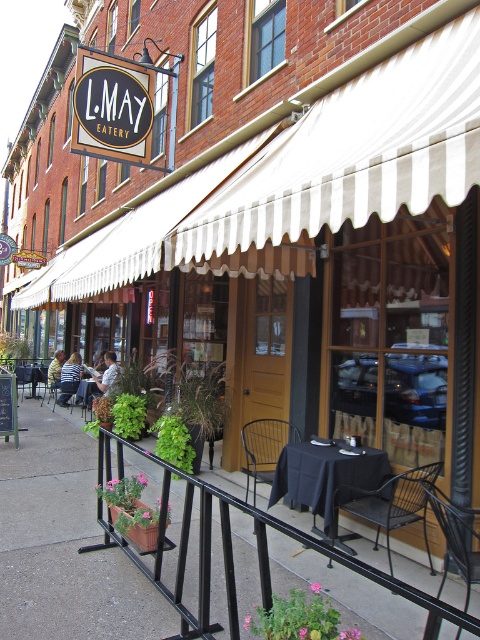
Is white striped awning at center shorter than light brown hair at center?

No.

Does point (396, 164) come behind point (108, 388)?

No, (396, 164) is closer to viewer.

Where is `white striped awning at center`? The width and height of the screenshot is (480, 640). white striped awning at center is located at coordinates (349, 157).

Locate an element on the screen. The width and height of the screenshot is (480, 640). white striped awning at center is located at coordinates (349, 157).

Who is more distant from viewer, (305,129) or (459,531)?

Point (305,129)

How distant is white striped awning at center from black metal chair at lower right?

The distance of white striped awning at center from black metal chair at lower right is 2.53 meters.

Locate an element on the screen. The height and width of the screenshot is (640, 480). white striped awning at center is located at coordinates (349, 157).

Where is `black wire chair at lower center`? This screenshot has width=480, height=640. black wire chair at lower center is located at coordinates pos(264,449).

Which of these two, black wire chair at lower center or light brown hair at center, stands taller?

black wire chair at lower center is taller.

You are a GUI agent. You are given a task and a screenshot of the screen. Output one action in this format:
    pyautogui.click(x=<x>, y=<y>)
    Task: Click on the black wire chair at lower center
    This screenshot has height=640, width=480.
    Given the screenshot: What is the action you would take?
    pyautogui.click(x=264, y=449)